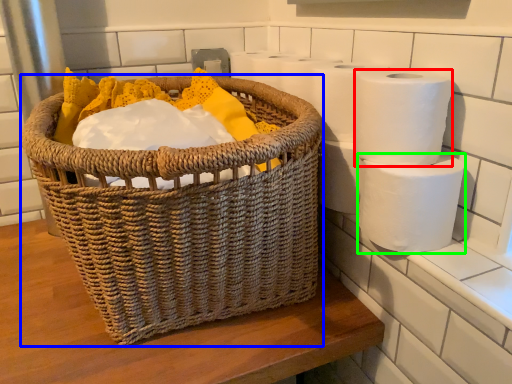
Question: Estimate the real-world distances between objects in this image. Which object is farther from toilet paper (highlighted by a red box), picnic basket (highlighted by a blue box) or toilet paper (highlighted by a green box)?

Choices:
 (A) picnic basket
 (B) toilet paper

Answer: (A)